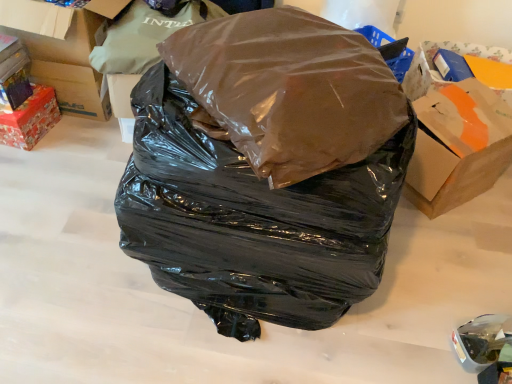
Question: From a real-world perspective, is matte cardboard box at upper left physically located above or below brown matte plastic bag at center, placed as the 1th plastic bag when sorted from bottom to top?

Choices:
 (A) below
 (B) above

Answer: (A)

Question: Is point (16, 102) positioned closer to the camera than point (352, 299)?

Choices:
 (A) closer
 (B) farther

Answer: (B)

Question: Estimate the real-world distances between objects in this image. Which object is farther from the matte cardboard box at left, the 2th box in the bottom-to-top sequence?

Choices:
 (A) shiny metallic box at left, the first box in the bottom-to-top sequence
 (B) brown matte plastic bag at center, which is counted as the 2th plastic bag, starting from the bottom
 (C) matte cardboard box at upper left
 (D) brown matte plastic bag at center, which is counted as the 3th plastic bag, starting from the top
 (E) brown cardboard box at right

Answer: (E)

Question: Considering the real-world distances, which object is closest to the brown matte plastic bag at center, which is the 2th plastic bag in top-to-bottom order?

Choices:
 (A) brown matte plastic bag at center, placed as the 1th plastic bag when sorted from bottom to top
 (B) brown cardboard box at right
 (C) matte cardboard box at upper left
 (D) brown matte plastic bag at upper center, the first plastic bag viewed from the top
 (E) shiny metallic box at left, the first box in the bottom-to-top sequence

Answer: (A)